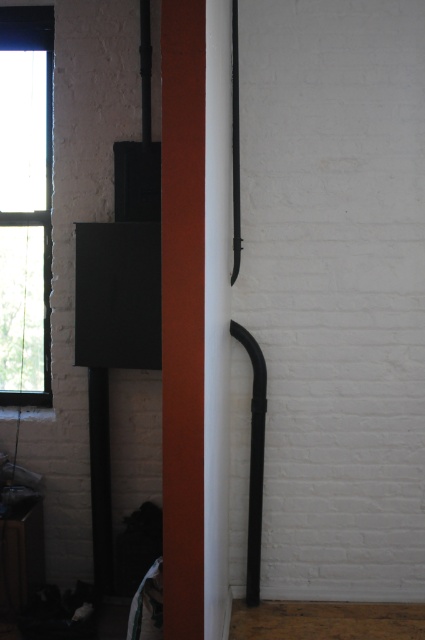
Question: Is matte wood pillar at center smaller than clear glass window at left?

Choices:
 (A) no
 (B) yes

Answer: (B)

Question: Which point is farther to the camera?

Choices:
 (A) (161, 93)
 (B) (37, 128)

Answer: (B)

Question: Which of the following is the farthest from the observer?

Choices:
 (A) black matte pipe at center
 (B) clear glass window at left
 (C) matte wood pillar at center

Answer: (B)

Question: Does matte wood pillar at center have a greater width compared to clear glass window at left?

Choices:
 (A) no
 (B) yes

Answer: (A)

Question: In this image, where is matte wood pillar at center located relative to clear glass window at left?

Choices:
 (A) below
 (B) above

Answer: (A)

Question: Which point is closer to the camera taking this photo?

Choices:
 (A) (163, 228)
 (B) (33, 403)
 (C) (260, 472)

Answer: (A)